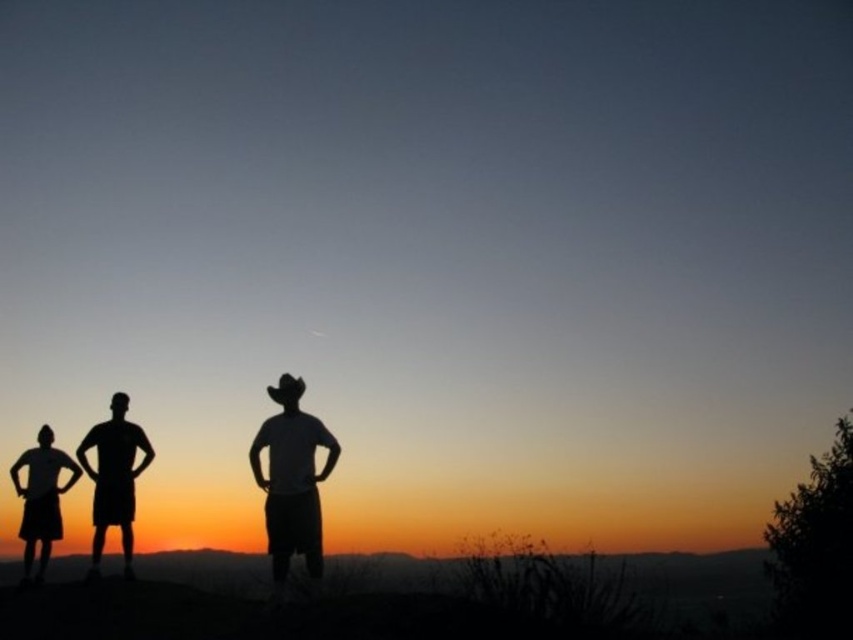
Which is more to the right, silhouette cowboy hat at left or silhouette child at left?

Positioned to the right is silhouette cowboy hat at left.

Which is more to the left, silhouette cowboy hat at left or silhouette child at left?

From the viewer's perspective, silhouette child at left appears more on the left side.

This screenshot has height=640, width=853. Identify the location of silhouette cowboy hat at left. (113, 477).

Locate an element on the screen. Image resolution: width=853 pixels, height=640 pixels. silhouette cowboy hat at left is located at coordinates (113, 477).

Is white matte cowboy hat at center below silhouette child at left?

No, white matte cowboy hat at center is not below silhouette child at left.

Which is behind, point (306, 541) or point (41, 496)?

The point (41, 496) is behind.

What do you see at coordinates (292, 480) in the screenshot? The height and width of the screenshot is (640, 853). I see `white matte cowboy hat at center` at bounding box center [292, 480].

I want to click on white matte cowboy hat at center, so click(292, 480).

The width and height of the screenshot is (853, 640). Describe the element at coordinates (292, 480) in the screenshot. I see `white matte cowboy hat at center` at that location.

Which is above, white matte cowboy hat at center or silhouette cowboy hat at left?

white matte cowboy hat at center is higher up.

Find the location of `white matte cowboy hat at center`. white matte cowboy hat at center is located at coordinates (292, 480).

Find the location of a particular element. Image resolution: width=853 pixels, height=640 pixels. white matte cowboy hat at center is located at coordinates (292, 480).